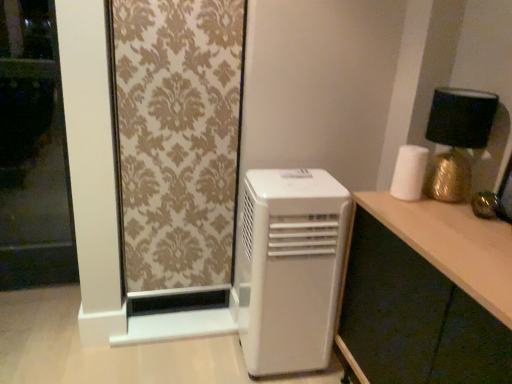
Question: In the image, is white plastic air conditioner at lower center positioned in front of or behind wooden desk at right?

Choices:
 (A) front
 (B) behind

Answer: (B)

Question: Is white plastic air conditioner at lower center situated inside wooden desk at right or outside?

Choices:
 (A) outside
 (B) inside

Answer: (A)

Question: Estimate the real-world distances between objects in this image. Which object is closer to the white plastic air conditioner at lower center?

Choices:
 (A) white matte paper towel at right
 (B) transparent glass screen door at left
 (C) gold damask fabric at upper left
 (D) gold metallic table lamp at upper right
 (E) wooden desk at right

Answer: (E)

Question: Which object is positioned farthest from the wooden desk at right?

Choices:
 (A) gold metallic table lamp at upper right
 (B) white plastic air conditioner at lower center
 (C) transparent glass screen door at left
 (D) white matte paper towel at right
 (E) gold damask fabric at upper left

Answer: (C)